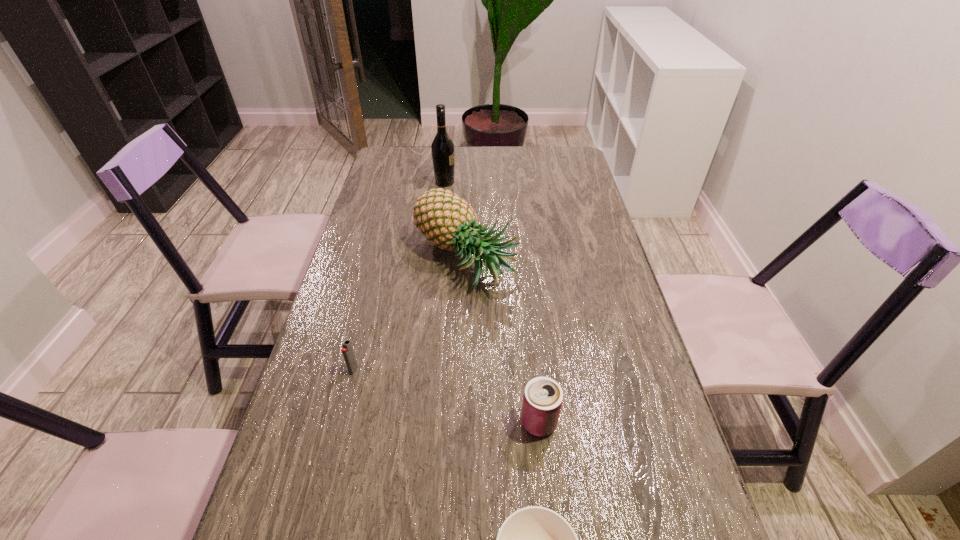
Where is `the tallest object`? Image resolution: width=960 pixels, height=540 pixels. the tallest object is located at coordinates (442, 148).

You are a GUI agent. You are given a task and a screenshot of the screen. Output one action in this format:
    pyautogui.click(x=<x>, y=<y>)
    Task: Click on the farthest object
    
    Given the screenshot: What is the action you would take?
    pyautogui.click(x=442, y=148)

You are a GUI agent. You are given a task and a screenshot of the screen. Output one action in this format:
    pyautogui.click(x=<x>, y=<y>)
    Task: Click on the second farthest object
    The height and width of the screenshot is (540, 960).
    Given the screenshot: What is the action you would take?
    pyautogui.click(x=446, y=220)

Find the location of a particular element. Image resolution: width=960 pixels, height=540 pixels. the fourth shortest object is located at coordinates (446, 220).

Find the location of a particular element. the second nearest object is located at coordinates (542, 401).

At what (x,y) coordinates should I click in order to perform the action: click on igniter. Please return your answer as a coordinate pair (x, y). The height and width of the screenshot is (540, 960). Looking at the image, I should click on (347, 350).

Find the location of `the fourth tallest object`. the fourth tallest object is located at coordinates (347, 350).

Where is `blank space located 0.370m on the label of the farthest object`? The height and width of the screenshot is (540, 960). blank space located 0.370m on the label of the farthest object is located at coordinates pyautogui.click(x=557, y=182).

The height and width of the screenshot is (540, 960). In order to click on vacant space located 0.390m on the back of the second farthest object in this screenshot , I will do `click(468, 165)`.

You are a GUI agent. You are given a task and a screenshot of the screen. Output one action in this format:
    pyautogui.click(x=<x>, y=<y>)
    Task: Click on the free space located on the back of the second nearest object
    This screenshot has height=540, width=960.
    Given the screenshot: What is the action you would take?
    pyautogui.click(x=533, y=364)